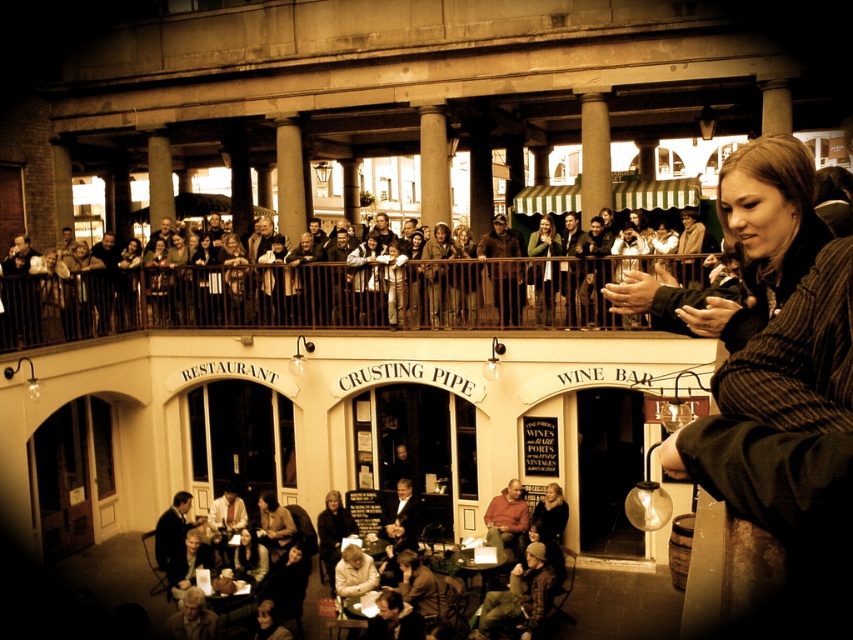
This screenshot has width=853, height=640. What are the coordinates of `brown leather jacket at upper center` in the screenshot? It's located at (318, 296).

Is brown leather jacket at upper center to the left of green fabric jacket at upper center from the viewer's perspective?

Indeed, brown leather jacket at upper center is positioned on the left side of green fabric jacket at upper center.

Who is more forward, [187,291] or [538,291]?

Point [538,291] is more forward.

Where is `brown leather jacket at upper center`? This screenshot has height=640, width=853. brown leather jacket at upper center is located at coordinates (318, 296).